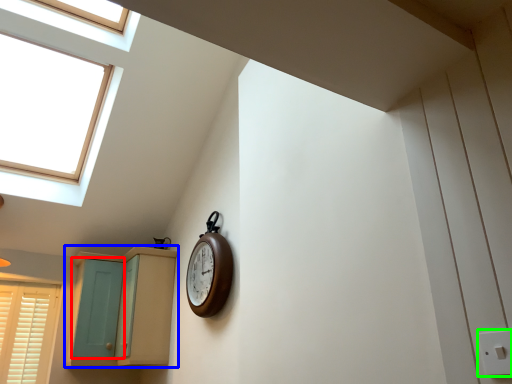
Question: Considering the real-world distances, which object is farthest from screen door (highlighted by a red box)? cabinetry (highlighted by a blue box) or electric outlet (highlighted by a green box)?

Choices:
 (A) cabinetry
 (B) electric outlet

Answer: (B)